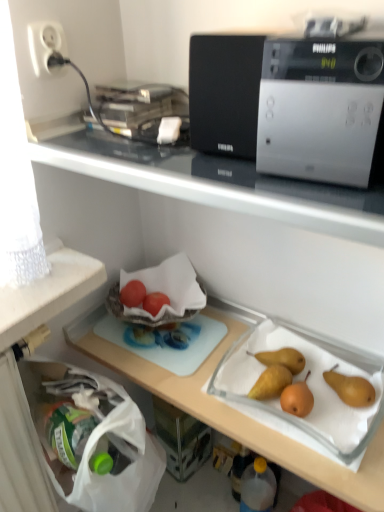
From the picture: What is the approximate width of transparent plastic bottle at lower center?

3.78 inches.

What do you see at coordinates (46, 46) in the screenshot?
I see `white plastic socket at upper left` at bounding box center [46, 46].

What do you see at coordinates (155, 302) in the screenshot? I see `matte red tomato at center, which is counted as the 2th fruit, starting from the left` at bounding box center [155, 302].

This screenshot has height=512, width=384. I want to click on silver metallic microwave at upper center, so click(322, 111).

The height and width of the screenshot is (512, 384). I want to click on transparent plastic bottle at lower center, so click(x=258, y=487).

From a real-world perspective, is transparent plastic bottle at lower center below matte red tomato at center, the first fruit when ordered from right to left?

Yes, from a real-world perspective, transparent plastic bottle at lower center is below matte red tomato at center, the first fruit when ordered from right to left.

Which object is closer to the camera taking this photo, transparent plastic bottle at lower center or matte red tomato at center, which is counted as the 2th fruit, starting from the left?

transparent plastic bottle at lower center is more forward.

Between point (253, 490) and point (153, 308), which one is positioned behind?

The point (253, 490) is behind.

Considering the sizes of objects white plastic socket at upper left and matte red tomato at center-left, the 1th fruit positioned from the left, in the image provided, who is thinner, white plastic socket at upper left or matte red tomato at center-left, the 1th fruit positioned from the left,?

With smaller width is white plastic socket at upper left.

From the image's perspective, is white plastic socket at upper left located above or below matte red tomato at center-left, the 1th fruit positioned from the left?

Based on their image positions, white plastic socket at upper left is located above matte red tomato at center-left, the 1th fruit positioned from the left.

Is white plastic socket at upper left oriented towards matte red tomato at center-left, the 1th fruit positioned from the left?

No, white plastic socket at upper left is not oriented towards matte red tomato at center-left, the 1th fruit positioned from the left.

Is white plastic socket at upper left situated inside matte red tomato at center-left, the 1th fruit positioned from the left, or outside?

The correct answer is: outside.

Between silver metallic microwave at upper center and matte red tomato at center, which is counted as the 2th fruit, starting from the left, which one has larger width?

silver metallic microwave at upper center is wider.

Locate an element on the screen. The height and width of the screenshot is (512, 384). fruit that is the 2nd one when counting backward from the silver metallic microwave at upper center is located at coordinates (155, 302).

Is silver metallic microwave at upper center closer to the viewer compared to matte red tomato at center, the first fruit when ordered from right to left?

Yes, silver metallic microwave at upper center is closer to the camera.

Between silver metallic microwave at upper center and matte red tomato at center, the first fruit when ordered from right to left, which one has more height?

Standing taller between the two is silver metallic microwave at upper center.

Is transparent plastic bottle at lower center positioned far away from white plastic socket at upper left?

Yes.

Could you measure the distance between transparent plastic bottle at lower center and white plastic socket at upper left?

transparent plastic bottle at lower center and white plastic socket at upper left are 1.08 meters apart.

Looking at this image, is transparent plastic bottle at lower center oriented away from white plastic socket at upper left?

That's not correct — transparent plastic bottle at lower center is not looking away from white plastic socket at upper left.

Which is farther, (247, 466) or (49, 57)?

The point (247, 466) is farther from the camera.

Does matte red tomato at center-left, the 2th fruit from the right, come in front of matte red tomato at center, which is counted as the 2th fruit, starting from the left?

Yes, matte red tomato at center-left, the 2th fruit from the right, is closer to the camera.

From their relative heights in the image, would you say matte red tomato at center-left, the 1th fruit positioned from the left, is taller or shorter than matte red tomato at center, which is counted as the 2th fruit, starting from the left?

Clearly, matte red tomato at center-left, the 1th fruit positioned from the left, is taller compared to matte red tomato at center, which is counted as the 2th fruit, starting from the left.

Which of these two, matte red tomato at center-left, the 2th fruit from the right, or matte red tomato at center, which is counted as the 2th fruit, starting from the left, is bigger?

With larger size is matte red tomato at center-left, the 2th fruit from the right.

In the scene shown: Which is correct: matte red tomato at center-left, the 2th fruit from the right, is inside matte red tomato at center, which is counted as the 2th fruit, starting from the left, or outside of it?

matte red tomato at center-left, the 2th fruit from the right, is spatially situated outside matte red tomato at center, which is counted as the 2th fruit, starting from the left.

Consider the image. From a real-world perspective, does matte red tomato at center-left, the 2th fruit from the right, sit lower than transparent plastic bottle at lower center?

No, from a real-world perspective, matte red tomato at center-left, the 2th fruit from the right, is not below transparent plastic bottle at lower center.

Does matte red tomato at center-left, the 2th fruit from the right, appear on the left side of transparent plastic bottle at lower center?

Correct, you'll find matte red tomato at center-left, the 2th fruit from the right, to the left of transparent plastic bottle at lower center.

Is matte red tomato at center-left, the 1th fruit positioned from the left, wider than transparent plastic bottle at lower center?

Incorrect, the width of matte red tomato at center-left, the 1th fruit positioned from the left, does not surpass that of transparent plastic bottle at lower center.

Does matte red tomato at center-left, the 2th fruit from the right, turn towards transparent plastic bottle at lower center?

No, matte red tomato at center-left, the 2th fruit from the right, is not turned towards transparent plastic bottle at lower center.

Who is bigger, silver metallic microwave at upper center or white plastic socket at upper left?

silver metallic microwave at upper center is bigger.

Is silver metallic microwave at upper center facing towards white plastic socket at upper left?

No, silver metallic microwave at upper center is not oriented towards white plastic socket at upper left.

Considering the positions of points (329, 44) and (42, 24), is point (329, 44) farther from camera compared to point (42, 24)?

That is False.

The image size is (384, 512). Find the location of `electric outlet located above the silver metallic microwave at upper center (from the image's perspective)`. electric outlet located above the silver metallic microwave at upper center (from the image's perspective) is located at coordinates (46, 46).

Find the location of a particular element. This screenshot has width=384, height=512. bottle below the matte red tomato at center, the first fruit when ordered from right to left (from a real-world perspective) is located at coordinates (258, 487).

Find the location of a particular element. The width and height of the screenshot is (384, 512). the 1st fruit counting from the right side of the white plastic socket at upper left is located at coordinates (133, 293).

Based on their spatial positions, is matte red tomato at center, which is counted as the 2th fruit, starting from the left, or white plastic socket at upper left closer to matte red tomato at center-left, the 2th fruit from the right?

matte red tomato at center, which is counted as the 2th fruit, starting from the left.

Looking at the image, which one is located further to white plastic socket at upper left, matte red tomato at center, the first fruit when ordered from right to left, or matte red tomato at center-left, the 1th fruit positioned from the left?

Based on the image, matte red tomato at center, the first fruit when ordered from right to left, appears to be further to white plastic socket at upper left.

Which object lies further to the anchor point transparent plastic bottle at lower center, white plastic socket at upper left or matte red tomato at center-left, the 2th fruit from the right?

Among the two, white plastic socket at upper left is located further to transparent plastic bottle at lower center.

When comparing their distances from matte red tomato at center, the first fruit when ordered from right to left, does transparent plastic bottle at lower center or matte red tomato at center-left, the 1th fruit positioned from the left, seem further?

Among the two, transparent plastic bottle at lower center is located further to matte red tomato at center, the first fruit when ordered from right to left.

Based on their spatial positions, is silver metallic microwave at upper center or matte red tomato at center-left, the 2th fruit from the right, further from white plastic socket at upper left?

Based on the image, matte red tomato at center-left, the 2th fruit from the right, appears to be further to white plastic socket at upper left.

When comparing their distances from matte red tomato at center-left, the 1th fruit positioned from the left, does white plastic socket at upper left or transparent plastic bottle at lower center seem further?

transparent plastic bottle at lower center lies further to matte red tomato at center-left, the 1th fruit positioned from the left, than the other object.

Looking at this image, looking at the image, which one is located closer to white plastic socket at upper left, transparent plastic bottle at lower center or matte red tomato at center-left, the 2th fruit from the right?

matte red tomato at center-left, the 2th fruit from the right.

Considering their positions, is silver metallic microwave at upper center positioned further to white plastic socket at upper left than matte red tomato at center, the first fruit when ordered from right to left?

matte red tomato at center, the first fruit when ordered from right to left.

You are a GUI agent. You are given a task and a screenshot of the screen. Output one action in this format:
    pyautogui.click(x=<x>, y=<y>)
    Task: Click on the fruit between matte red tomato at center-left, the 1th fruit positioned from the left, and transparent plastic bottle at lower center in the up-down direction
    This screenshot has height=512, width=384.
    Given the screenshot: What is the action you would take?
    pyautogui.click(x=155, y=302)

Identify the location of electric outlet between silver metallic microwave at upper center and matte red tomato at center-left, the 1th fruit positioned from the left, from front to back. Image resolution: width=384 pixels, height=512 pixels. pyautogui.click(x=46, y=46).

Where is `fruit between silver metallic microwave at upper center and matte red tomato at center, the first fruit when ordered from right to left, from front to back`? The width and height of the screenshot is (384, 512). fruit between silver metallic microwave at upper center and matte red tomato at center, the first fruit when ordered from right to left, from front to back is located at coordinates (133, 293).

You are a GUI agent. You are given a task and a screenshot of the screen. Output one action in this format:
    pyautogui.click(x=<x>, y=<y>)
    Task: Click on the fruit between white plastic socket at upper left and matte red tomato at center, which is counted as the 2th fruit, starting from the left, in the vertical direction
    Image resolution: width=384 pixels, height=512 pixels.
    Given the screenshot: What is the action you would take?
    pyautogui.click(x=133, y=293)